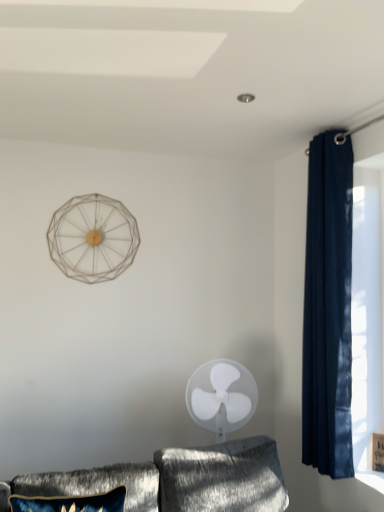
The height and width of the screenshot is (512, 384). I want to click on velvet blue pillow at lower left, so click(x=97, y=484).

Is velvet blue pillow at lower left to the left of navy velvet curtain at right from the viewer's perspective?

Yes, velvet blue pillow at lower left is to the left of navy velvet curtain at right.

Does point (29, 486) lie in front of point (337, 156)?

That is True.

How different are the orientations of velvet blue pillow at lower left and navy velvet curtain at right in degrees?

They differ by 81 degrees in their facing directions.

Locate an element on the screen. This screenshot has width=384, height=512. pillow that appears on the left of navy velvet curtain at right is located at coordinates (97, 484).

The height and width of the screenshot is (512, 384). Identify the location of mechanical fan located behind the navy velvet curtain at right. (221, 396).

Does white plastic fan at center lie behind navy velvet curtain at right?

Yes.

Is white plastic fan at center beside navy velvet curtain at right?

No.

Are navy velvet curtain at right and velvet blue pillow at lower left located far from each other?

Yes.

Is navy velvet curtain at right oriented towards velvet blue pillow at lower left?

Yes, navy velvet curtain at right is turned towards velvet blue pillow at lower left.

Considering the positions of objects navy velvet curtain at right and velvet blue pillow at lower left in the image provided, who is behind, navy velvet curtain at right or velvet blue pillow at lower left?

navy velvet curtain at right.

From the picture: From a real-world perspective, which is physically below, navy velvet curtain at right or velvet blue pillow at lower left?

From a 3D spatial view, velvet blue pillow at lower left is below.

Where is `pillow located on the left of white plastic fan at center`? The height and width of the screenshot is (512, 384). pillow located on the left of white plastic fan at center is located at coordinates (97, 484).

What's the angular difference between white plastic fan at center and velvet blue pillow at lower left's facing directions?

The angular difference between white plastic fan at center and velvet blue pillow at lower left is 11.4 degrees.

Does point (251, 394) appear closer or farther from the camera than point (81, 489)?

Point (251, 394) is farther from the camera than point (81, 489).

From a real-world perspective, is white plastic fan at center positioned above or below velvet blue pillow at lower left?

white plastic fan at center is situated higher than velvet blue pillow at lower left in the real world.

Can you confirm if navy velvet curtain at right is thinner than white plastic fan at center?

Correct, the width of navy velvet curtain at right is less than that of white plastic fan at center.

Is navy velvet curtain at right taller or shorter than white plastic fan at center?

navy velvet curtain at right is taller than white plastic fan at center.

From a real-world perspective, is navy velvet curtain at right located higher than white plastic fan at center?

Yes.

Would you consider navy velvet curtain at right to be distant from white plastic fan at center?

navy velvet curtain at right is actually quite close to white plastic fan at center.

From the image's perspective, is velvet blue pillow at lower left positioned above or below white plastic fan at center?

velvet blue pillow at lower left is situated lower than white plastic fan at center in the image.

Does velvet blue pillow at lower left appear on the left side of white plastic fan at center?

Yes.

Is the position of velvet blue pillow at lower left more distant than that of white plastic fan at center?

No, velvet blue pillow at lower left is closer to the viewer.

Find the location of a particular element. This screenshot has height=512, width=384. curtain on the right of velvet blue pillow at lower left is located at coordinates (328, 309).

Find the location of `mechanical fan located below the navy velvet curtain at right (from the image's perspective)`. mechanical fan located below the navy velvet curtain at right (from the image's perspective) is located at coordinates (221, 396).

Estimate the real-world distances between objects in this image. Which object is further from white plastic fan at center, velvet blue pillow at lower left or navy velvet curtain at right?

The object further to white plastic fan at center is velvet blue pillow at lower left.

Estimate the real-world distances between objects in this image. Which object is closer to white plastic fan at center, navy velvet curtain at right or velvet blue pillow at lower left?

navy velvet curtain at right.

Which object lies nearer to the anchor point velvet blue pillow at lower left, navy velvet curtain at right or white plastic fan at center?

The object closer to velvet blue pillow at lower left is white plastic fan at center.

Which object lies nearer to the anchor point navy velvet curtain at right, velvet blue pillow at lower left or white plastic fan at center?

white plastic fan at center is positioned closer to the anchor navy velvet curtain at right.

Based on their spatial positions, is white plastic fan at center or navy velvet curtain at right closer to velvet blue pillow at lower left?

white plastic fan at center lies closer to velvet blue pillow at lower left than the other object.

Which object lies further to the anchor point navy velvet curtain at right, white plastic fan at center or velvet blue pillow at lower left?

velvet blue pillow at lower left is positioned further to the anchor navy velvet curtain at right.

Where is `mechanical fan situated between velvet blue pillow at lower left and navy velvet curtain at right from left to right`? This screenshot has width=384, height=512. mechanical fan situated between velvet blue pillow at lower left and navy velvet curtain at right from left to right is located at coordinates (221, 396).